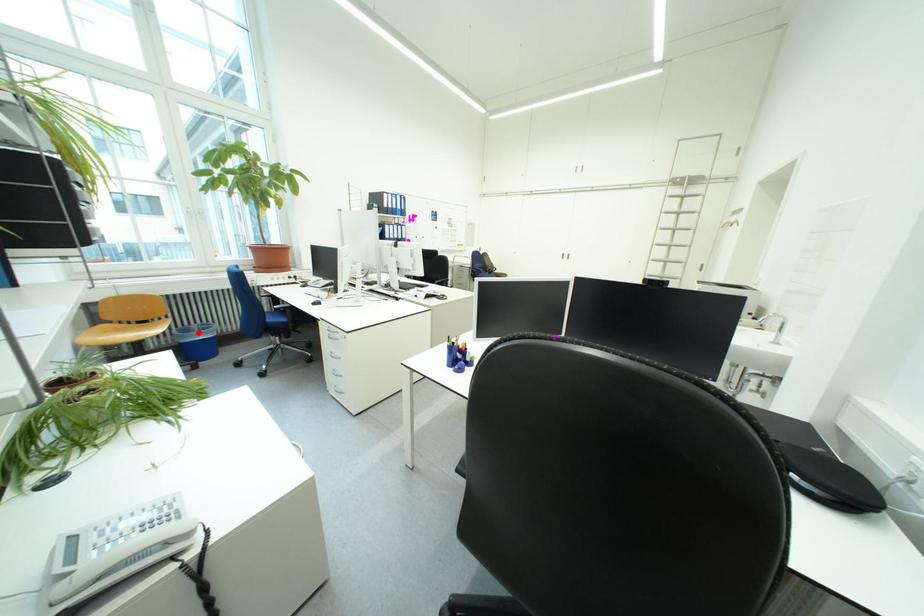
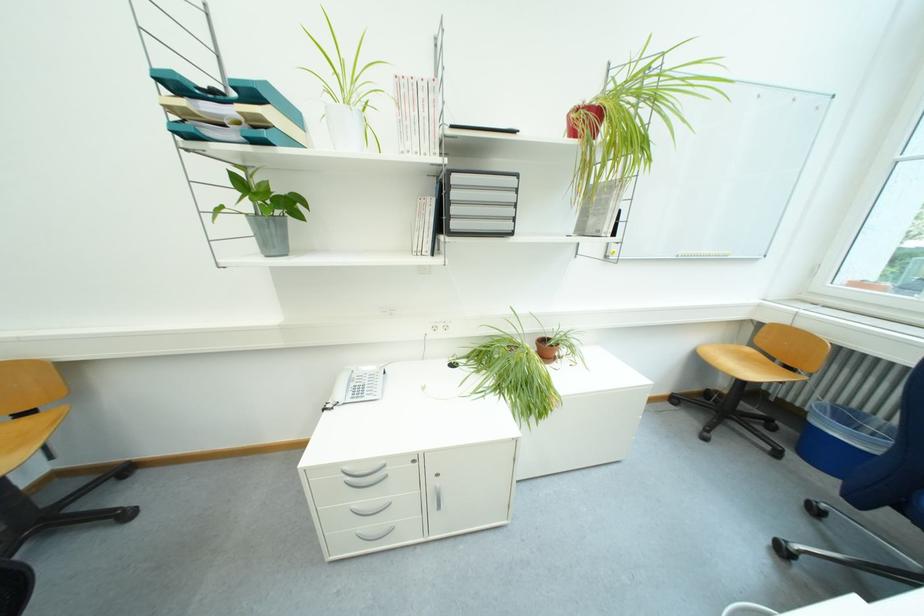
Question: A red point is marked in image1. In image2, is the corresponding 3D point closer to the camera or farther? Reply with the corresponding letter.

Choices:
 (A) The corresponding 3D point is closer.
 (B) The corresponding 3D point is farther.

Answer: (B)